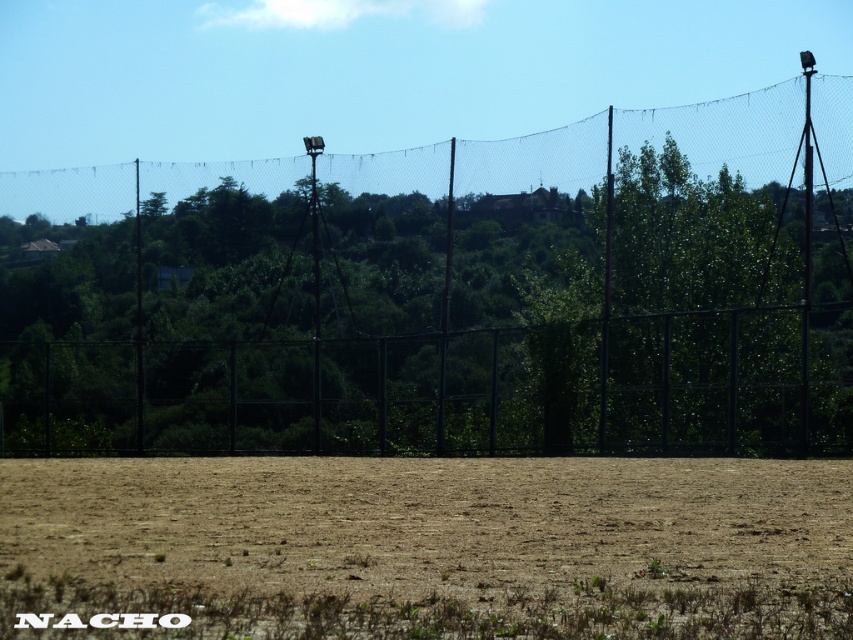
Is black wire mesh fence at upper center closer to the viewer compared to brown sandy soil at center?

No, black wire mesh fence at upper center is behind brown sandy soil at center.

Looking at this image, can you confirm if black wire mesh fence at upper center is thinner than brown sandy soil at center?

In fact, black wire mesh fence at upper center might be wider than brown sandy soil at center.

Identify the location of black wire mesh fence at upper center. (450, 292).